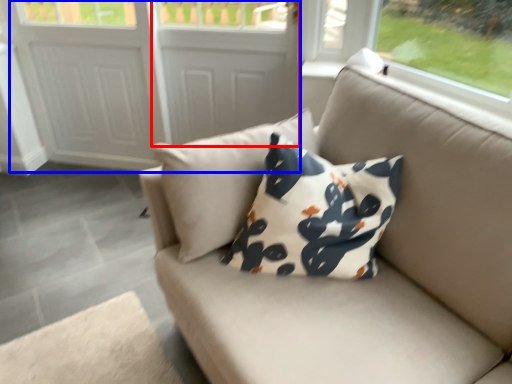
Question: Which of the following is the closest to the observer, screen door (highlighted by a red box) or screen door (highlighted by a blue box)?

Choices:
 (A) screen door
 (B) screen door

Answer: (A)